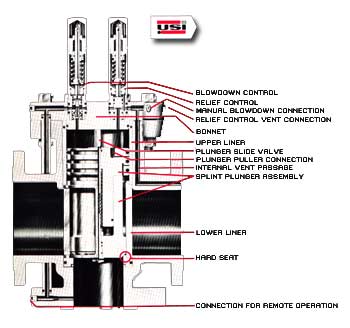
Identify the location of hard seat. pos(125,254).